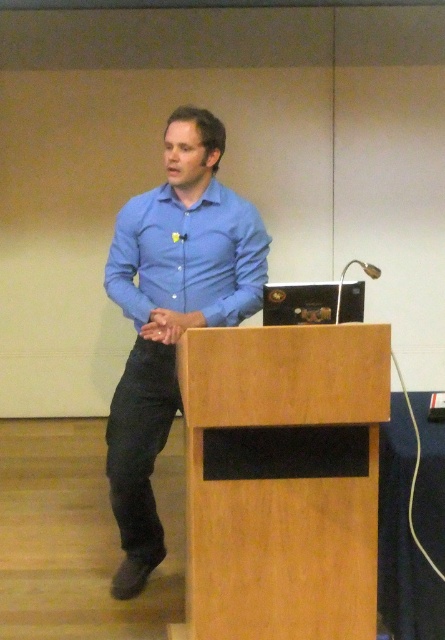
Question: Is wooden podium at center positioned at the back of matte blue shirt at center?

Choices:
 (A) no
 (B) yes

Answer: (A)

Question: Which point is farther from the camera taking this photo?

Choices:
 (A) (238, 285)
 (B) (328, 566)
 (C) (218, 209)

Answer: (C)

Question: Which object appears closest to the camera in this image?

Choices:
 (A) wooden podium at center
 (B) matte blue shirt at center

Answer: (A)

Question: Does blue cotton shirt at center appear on the left side of matte blue shirt at center?

Choices:
 (A) no
 (B) yes

Answer: (B)

Question: Can you confirm if blue cotton shirt at center is bigger than matte blue shirt at center?

Choices:
 (A) yes
 (B) no

Answer: (A)

Question: Which of the following is the farthest from the observer?

Choices:
 (A) (178, 264)
 (B) (343, 412)
 (C) (117, 225)

Answer: (C)